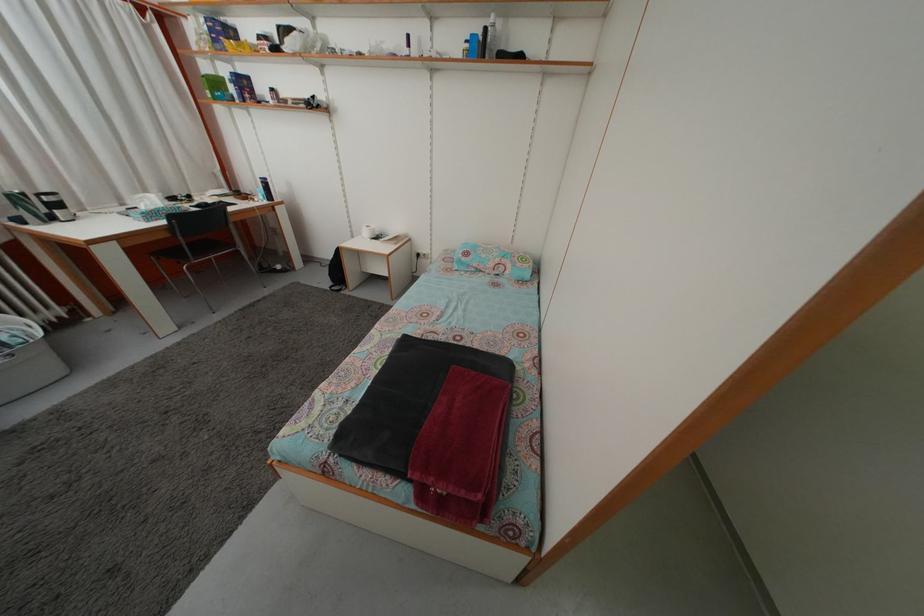
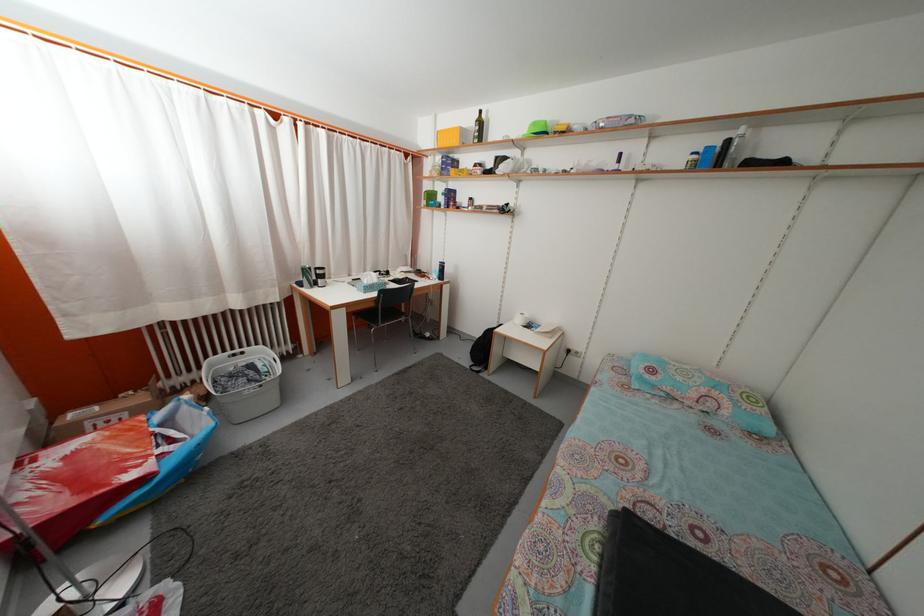
Locate, in the second image, the point that corresponds to [473,53] in the first image.

(699, 164)